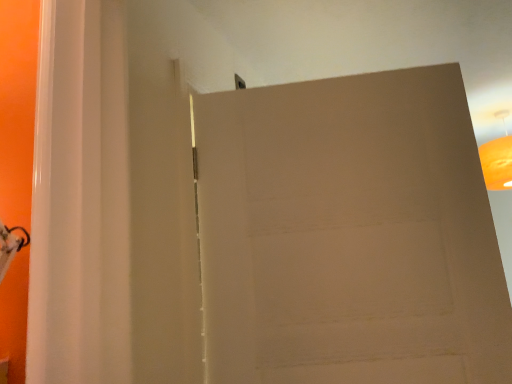
Question: Is point (506, 155) positioned closer to the camera than point (305, 114)?

Choices:
 (A) farther
 (B) closer

Answer: (A)

Question: From a real-world perspective, is orange matte lampshade at upper right positioned above or below matte brown door at upper center?

Choices:
 (A) below
 (B) above

Answer: (B)

Question: From the image's perspective, is orange matte lampshade at upper right located above or below matte brown door at upper center?

Choices:
 (A) above
 (B) below

Answer: (A)

Question: From a real-world perspective, is matte brown door at upper center physically located above or below orange matte lampshade at upper right?

Choices:
 (A) above
 (B) below

Answer: (B)

Question: Is matte brown door at upper center wider or thinner than orange matte lampshade at upper right?

Choices:
 (A) wide
 (B) thin

Answer: (B)

Question: In terms of size, does matte brown door at upper center appear bigger or smaller than orange matte lampshade at upper right?

Choices:
 (A) small
 (B) big

Answer: (B)

Question: Considering the positions of point (465, 380) and point (508, 139), is point (465, 380) closer or farther from the camera than point (508, 139)?

Choices:
 (A) farther
 (B) closer

Answer: (B)